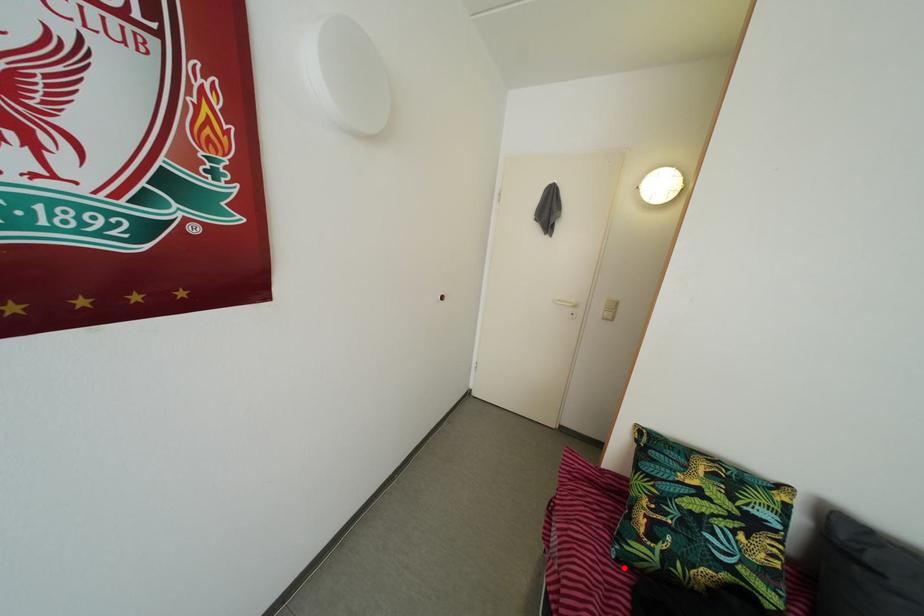
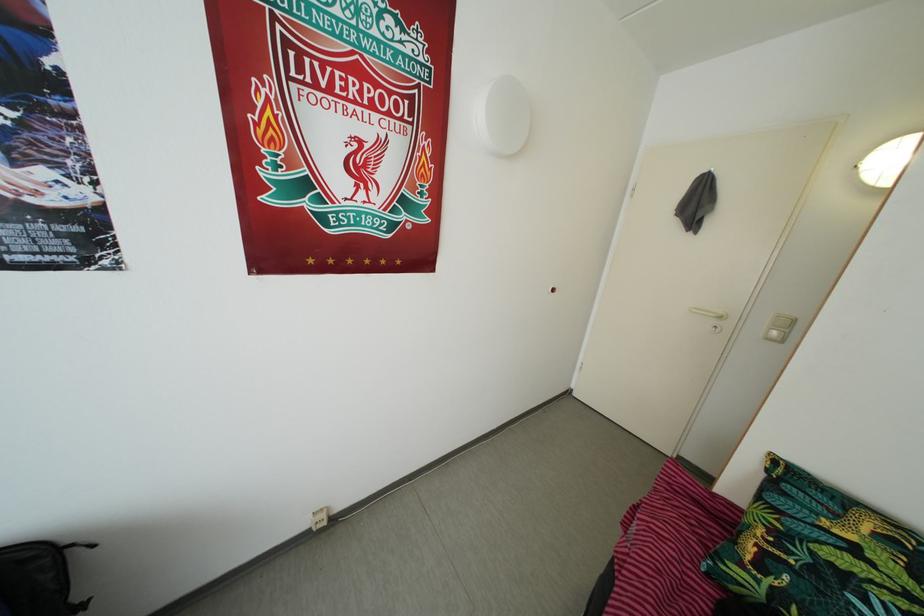
Locate, in the second image, the point that corresponds to the highlighted location in the first image.

(714, 583)